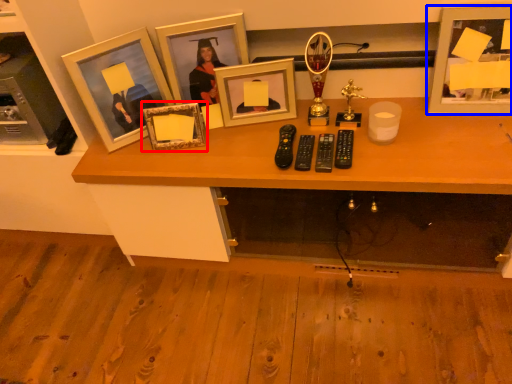
Question: Which of the following is the farthest to the observer, picture frame (highlighted by a red box) or picture frame (highlighted by a blue box)?

Choices:
 (A) picture frame
 (B) picture frame

Answer: (A)